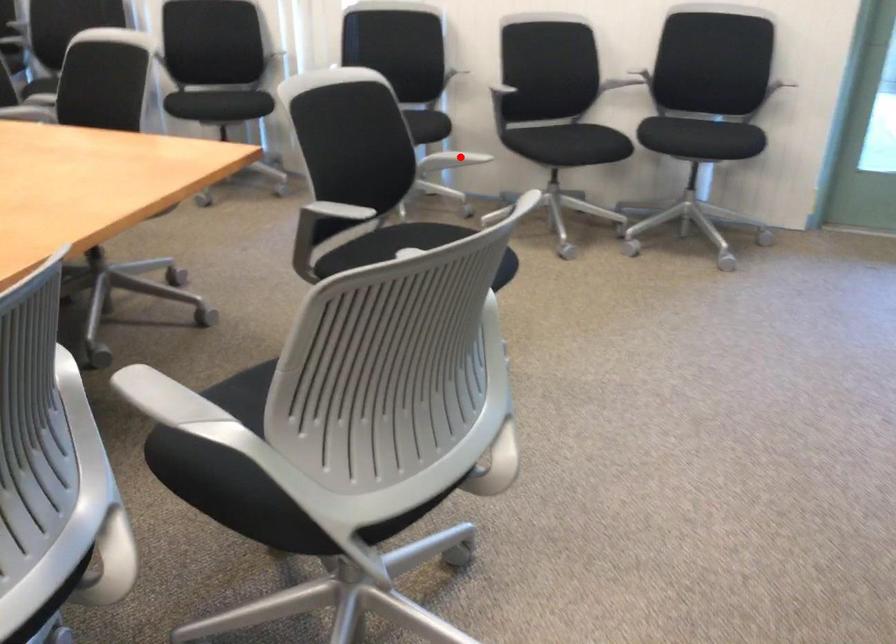
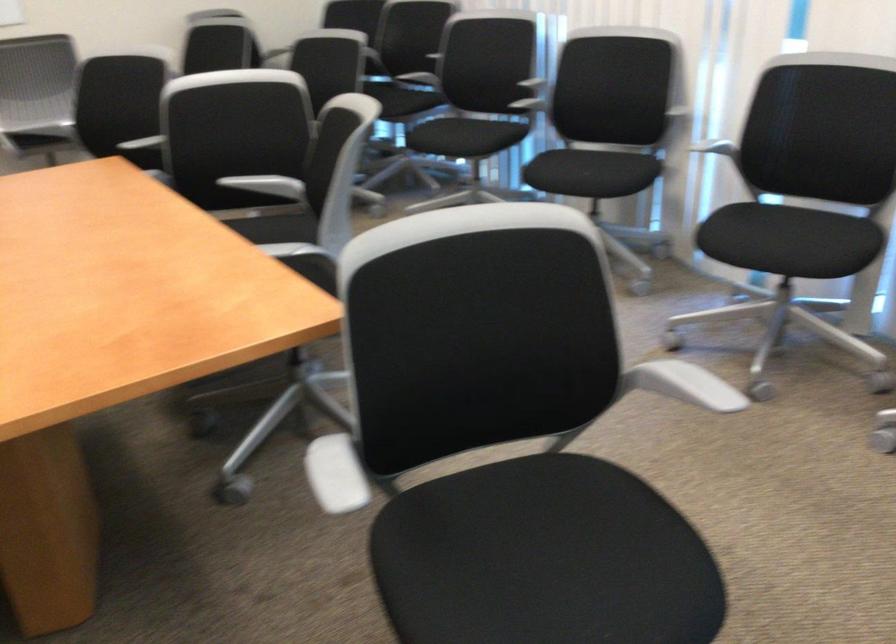
Locate, in the second image, the point that corresponds to the highlighted location in the first image.

(682, 384)